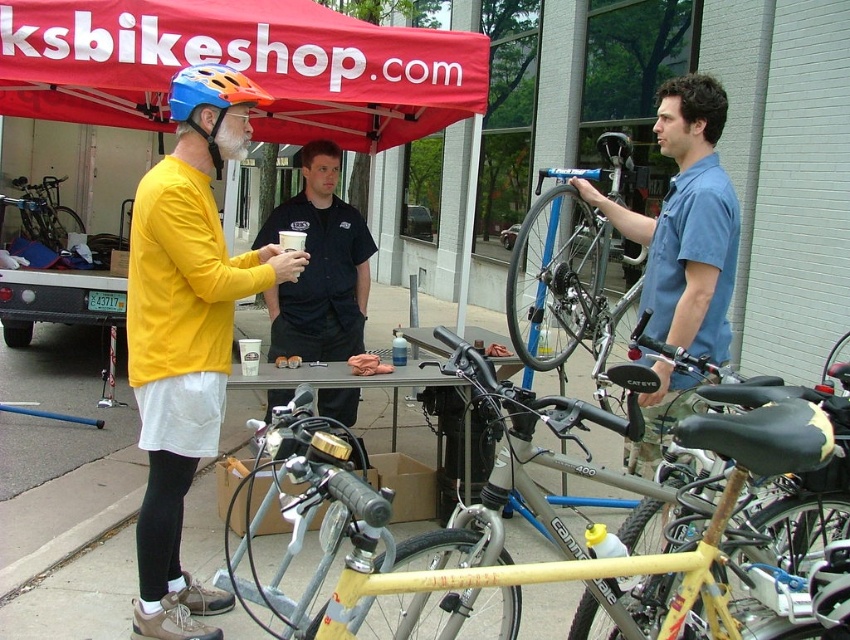
You are a customer looking to buy a bike. You see a blue cotton shirt at center and a matte black bicycle at left. Which item is taller?

The blue cotton shirt at center is much taller than the matte black bicycle at left.

You are a customer at the bike shop and want to try on the matte blue bicycle helmet at upper left. You are currently standing next to the blue cotton shirt at center. Can you reach the helmet without moving more than 5 feet?

The blue cotton shirt at center and matte blue bicycle helmet at upper left are 5.33 feet apart, so you would need to move more than 5 feet to reach the helmet.

You are a customer at the bike shop event and want to find the blue cotton shirt at center. According to the scene description, where would you look relative to the matte black bicycle at left?

The blue cotton shirt at center is to the right of the matte black bicycle at left, so you should look to the right side of the matte black bicycle at left to find it.